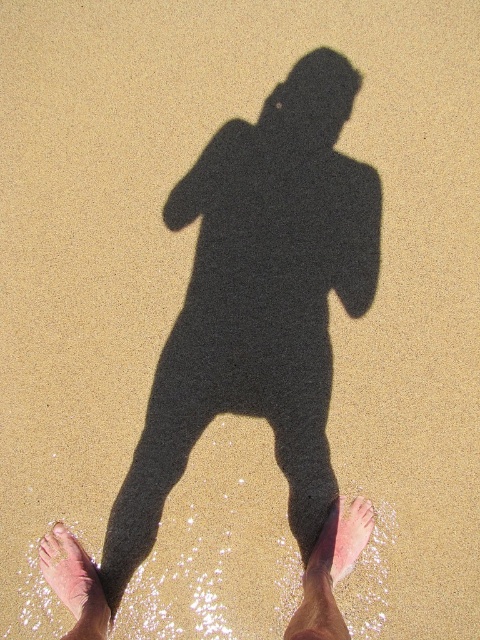
Question: Observing the image, what is the correct spatial positioning of pink skin at lower center in reference to pink flesh at lower left?

Choices:
 (A) below
 (B) above

Answer: (A)

Question: Which point is closer to the camera taking this photo?

Choices:
 (A) (328, 532)
 (B) (61, 534)

Answer: (B)

Question: Can you confirm if pink flesh at lower center is positioned to the left of pink skin at lower center?

Choices:
 (A) yes
 (B) no

Answer: (A)

Question: Which object appears farthest from the camera in this image?

Choices:
 (A) pink skin at lower center
 (B) pink flesh at lower left

Answer: (B)

Question: Which of the following is the closest to the observer?

Choices:
 (A) pink flesh at lower left
 (B) pink skin at lower center
 (C) pink flesh at lower center

Answer: (C)

Question: Can you confirm if pink skin at lower center is positioned below pink flesh at lower left?

Choices:
 (A) yes
 (B) no

Answer: (A)